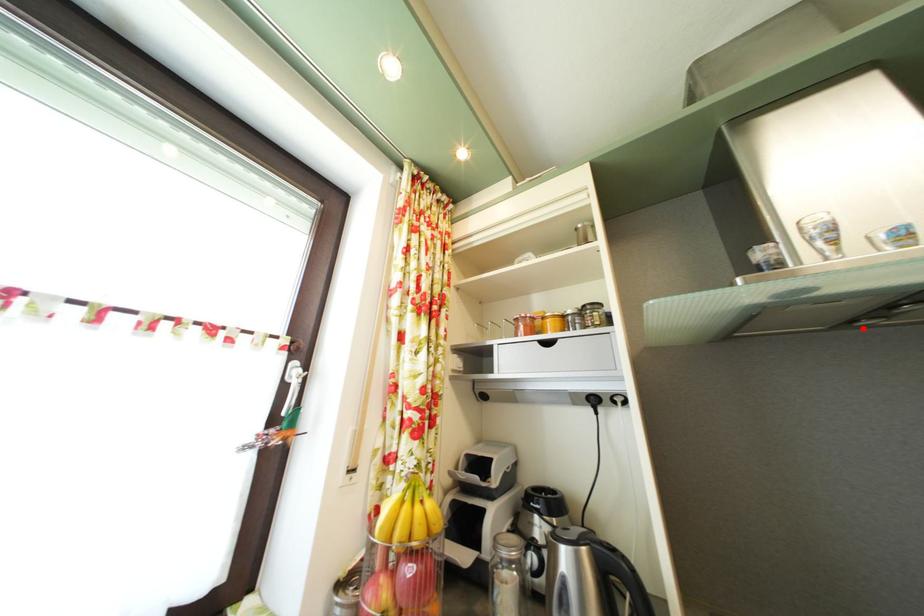
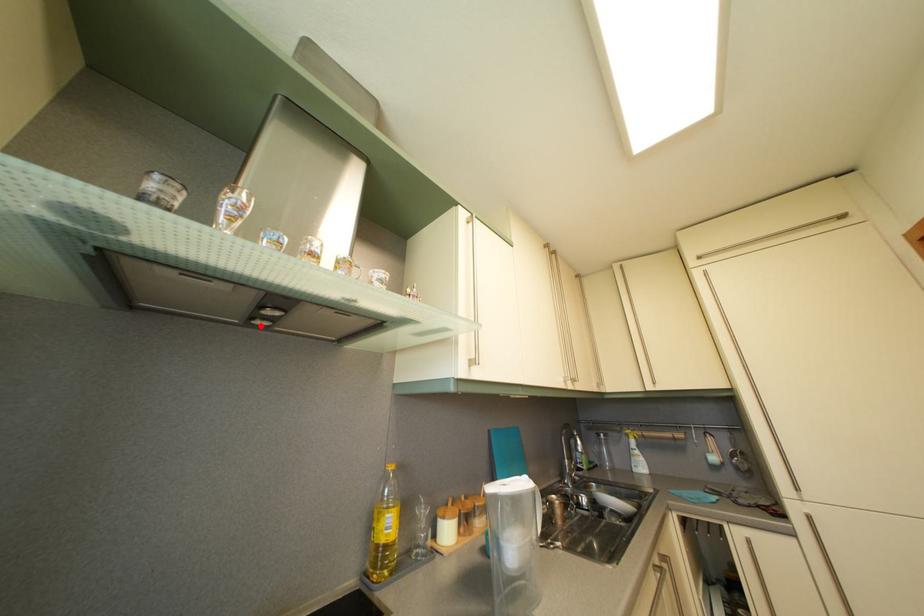
I am providing you with two images of the same scene from different viewpoints. A red point is marked on the first image and another point is marked on the second image. Is the red point in image1 aligned with the point shown in image2?

Yes